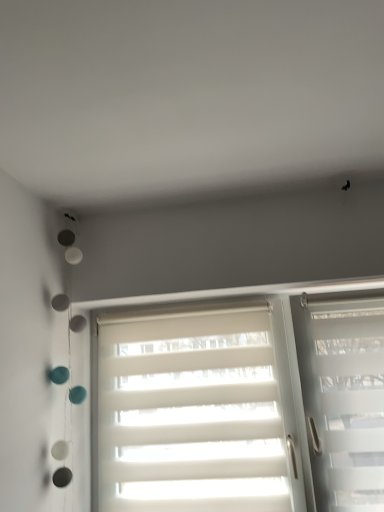
Identify the location of white matte blinds at center, marked as the 2th window in a right-to-left arrangement. The image size is (384, 512). coord(198,412).

This screenshot has height=512, width=384. What do you see at coordinates (198, 412) in the screenshot?
I see `white matte blinds at center, marked as the 2th window in a right-to-left arrangement` at bounding box center [198, 412].

How much space does transparent plastic window at right, the first window when ordered from right to left, occupy vertically?

transparent plastic window at right, the first window when ordered from right to left, is 30.32 inches tall.

Measure the distance between transparent plastic window at right, the first window when ordered from right to left, and camera.

They are 1.42 meters apart.

What is the approximate width of transparent plastic window at right, the second window in the left-to-right sequence?

It is 24.41 centimeters.

Identify the location of transparent plastic window at right, the first window when ordered from right to left. Image resolution: width=384 pixels, height=512 pixels. (343, 399).

Describe the element at coordinates (343, 399) in the screenshot. I see `transparent plastic window at right, the first window when ordered from right to left` at that location.

Where is `white matte blinds at center, marked as the 2th window in a right-to-left arrangement`? The image size is (384, 512). white matte blinds at center, marked as the 2th window in a right-to-left arrangement is located at coordinates (198, 412).

In the image, is white matte blinds at center, the 1th window from the left, on the left side or the right side of transparent plastic window at right, the second window in the left-to-right sequence?

→ In the image, white matte blinds at center, the 1th window from the left, appears on the left side of transparent plastic window at right, the second window in the left-to-right sequence.

Considering the relative positions of white matte blinds at center, marked as the 2th window in a right-to-left arrangement, and transparent plastic window at right, the second window in the left-to-right sequence, in the image provided, is white matte blinds at center, marked as the 2th window in a right-to-left arrangement, behind transparent plastic window at right, the second window in the left-to-right sequence,?

Yes, white matte blinds at center, marked as the 2th window in a right-to-left arrangement, is behind transparent plastic window at right, the second window in the left-to-right sequence.

Based on the photo, which is further, (154, 368) or (354, 482)?

Positioned behind is point (154, 368).

From the image's perspective, which one is positioned lower, white matte blinds at center, marked as the 2th window in a right-to-left arrangement, or transparent plastic window at right, the first window when ordered from right to left?

white matte blinds at center, marked as the 2th window in a right-to-left arrangement.

From a real-world perspective, is white matte blinds at center, marked as the 2th window in a right-to-left arrangement, physically located above or below transparent plastic window at right, the second window in the left-to-right sequence?

white matte blinds at center, marked as the 2th window in a right-to-left arrangement, is above transparent plastic window at right, the second window in the left-to-right sequence.

Is white matte blinds at center, the 1th window from the left, thinner than transparent plastic window at right, the first window when ordered from right to left?

Yes.

In terms of height, does white matte blinds at center, marked as the 2th window in a right-to-left arrangement, look taller or shorter compared to transparent plastic window at right, the first window when ordered from right to left?

white matte blinds at center, marked as the 2th window in a right-to-left arrangement, is shorter than transparent plastic window at right, the first window when ordered from right to left.

Considering the sizes of objects white matte blinds at center, the 1th window from the left, and transparent plastic window at right, the second window in the left-to-right sequence, in the image provided, who is bigger, white matte blinds at center, the 1th window from the left, or transparent plastic window at right, the second window in the left-to-right sequence,?

transparent plastic window at right, the second window in the left-to-right sequence.

Is white matte blinds at center, marked as the 2th window in a right-to-left arrangement, not inside transparent plastic window at right, the second window in the left-to-right sequence?

That's correct, white matte blinds at center, marked as the 2th window in a right-to-left arrangement, is outside of transparent plastic window at right, the second window in the left-to-right sequence.

Is there a large distance between white matte blinds at center, the 1th window from the left, and transparent plastic window at right, the second window in the left-to-right sequence?

No, white matte blinds at center, the 1th window from the left, is in close proximity to transparent plastic window at right, the second window in the left-to-right sequence.

Is transparent plastic window at right, the first window when ordered from right to left, at the back of white matte blinds at center, marked as the 2th window in a right-to-left arrangement?

No, white matte blinds at center, marked as the 2th window in a right-to-left arrangement, is not facing the opposite direction of transparent plastic window at right, the first window when ordered from right to left.

What's the angular difference between white matte blinds at center, marked as the 2th window in a right-to-left arrangement, and transparent plastic window at right, the first window when ordered from right to left,'s facing directions?

0.000306 degrees separate the facing orientations of white matte blinds at center, marked as the 2th window in a right-to-left arrangement, and transparent plastic window at right, the first window when ordered from right to left.

You are a GUI agent. You are given a task and a screenshot of the screen. Output one action in this format:
    pyautogui.click(x=<x>, y=<y>)
    Task: Click on the window below the white matte blinds at center, marked as the 2th window in a right-to-left arrangement (from a real-world perspective)
    
    Given the screenshot: What is the action you would take?
    pyautogui.click(x=343, y=399)

Is transparent plastic window at right, the first window when ordered from right to left, at the left side of white matte blinds at center, the 1th window from the left?

No, transparent plastic window at right, the first window when ordered from right to left, is not to the left of white matte blinds at center, the 1th window from the left.

Considering the relative positions of transparent plastic window at right, the second window in the left-to-right sequence, and white matte blinds at center, marked as the 2th window in a right-to-left arrangement, in the image provided, is transparent plastic window at right, the second window in the left-to-right sequence, behind white matte blinds at center, marked as the 2th window in a right-to-left arrangement,?

No, transparent plastic window at right, the second window in the left-to-right sequence, is closer to the camera.

Does point (330, 344) come closer to viewer compared to point (207, 342)?

Yes, it is in front of point (207, 342).

From the image's perspective, which object appears higher, transparent plastic window at right, the second window in the left-to-right sequence, or white matte blinds at center, the 1th window from the left?

transparent plastic window at right, the second window in the left-to-right sequence, from the image's perspective.

From a real-world perspective, is transparent plastic window at right, the first window when ordered from right to left, positioned above or below white matte blinds at center, marked as the 2th window in a right-to-left arrangement?

Clearly, from a real-world perspective, transparent plastic window at right, the first window when ordered from right to left, is below white matte blinds at center, marked as the 2th window in a right-to-left arrangement.

Looking at this image, is transparent plastic window at right, the second window in the left-to-right sequence, wider or thinner than white matte blinds at center, the 1th window from the left?

Clearly, transparent plastic window at right, the second window in the left-to-right sequence, has more width compared to white matte blinds at center, the 1th window from the left.

Considering the relative sizes of transparent plastic window at right, the second window in the left-to-right sequence, and white matte blinds at center, the 1th window from the left, in the image provided, is transparent plastic window at right, the second window in the left-to-right sequence, shorter than white matte blinds at center, the 1th window from the left,?

No.

Considering the relative sizes of transparent plastic window at right, the first window when ordered from right to left, and white matte blinds at center, the 1th window from the left, in the image provided, is transparent plastic window at right, the first window when ordered from right to left, bigger than white matte blinds at center, the 1th window from the left,?

Correct, transparent plastic window at right, the first window when ordered from right to left, is larger in size than white matte blinds at center, the 1th window from the left.

Does transparent plastic window at right, the first window when ordered from right to left, contain white matte blinds at center, the 1th window from the left?

Definitely not — white matte blinds at center, the 1th window from the left, is not inside transparent plastic window at right, the first window when ordered from right to left.

Is transparent plastic window at right, the second window in the left-to-right sequence, next to white matte blinds at center, the 1th window from the left, and touching it?

They are not placed beside each other.

Is transparent plastic window at right, the first window when ordered from right to left, looking in the opposite direction of white matte blinds at center, marked as the 2th window in a right-to-left arrangement?

No, white matte blinds at center, marked as the 2th window in a right-to-left arrangement, is not at the back of transparent plastic window at right, the first window when ordered from right to left.

Measure the distance from transparent plastic window at right, the first window when ordered from right to left, to white matte blinds at center, the 1th window from the left.

The distance of transparent plastic window at right, the first window when ordered from right to left, from white matte blinds at center, the 1th window from the left, is 12.91 inches.

Where is `window that is below the transparent plastic window at right, the second window in the left-to-right sequence (from the image's perspective)`? The width and height of the screenshot is (384, 512). window that is below the transparent plastic window at right, the second window in the left-to-right sequence (from the image's perspective) is located at coordinates (198, 412).

Locate an element on the screen. The image size is (384, 512). window that is behind the transparent plastic window at right, the second window in the left-to-right sequence is located at coordinates (198, 412).

Find the location of `window located above the transparent plastic window at right, the second window in the left-to-right sequence (from a real-world perspective)`. window located above the transparent plastic window at right, the second window in the left-to-right sequence (from a real-world perspective) is located at coordinates (198, 412).